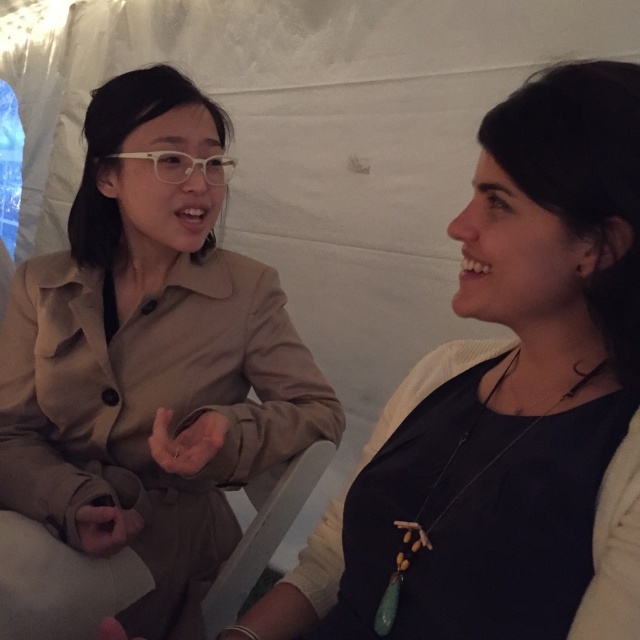
Question: From the image, what is the correct spatial relationship of matte black sweater at center in relation to tan fabric coat at left?

Choices:
 (A) left
 (B) right

Answer: (B)

Question: Which point is closer to the camera?

Choices:
 (A) (156, 449)
 (B) (563, 163)

Answer: (B)

Question: Which point is closer to the camera?

Choices:
 (A) tan fabric coat at left
 (B) matte black sweater at center

Answer: (B)

Question: Is matte black sweater at center below tan fabric coat at left?

Choices:
 (A) yes
 (B) no

Answer: (A)

Question: Is matte black sweater at center to the right of tan fabric coat at left from the viewer's perspective?

Choices:
 (A) yes
 (B) no

Answer: (A)

Question: Among these points, which one is farthest from the camera?

Choices:
 (A) (252, 472)
 (B) (417, 541)

Answer: (A)